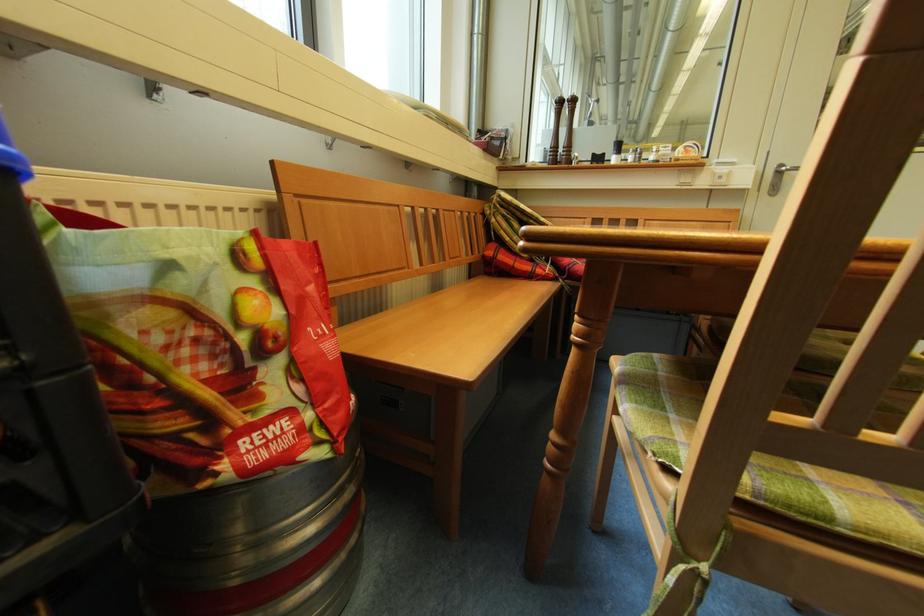
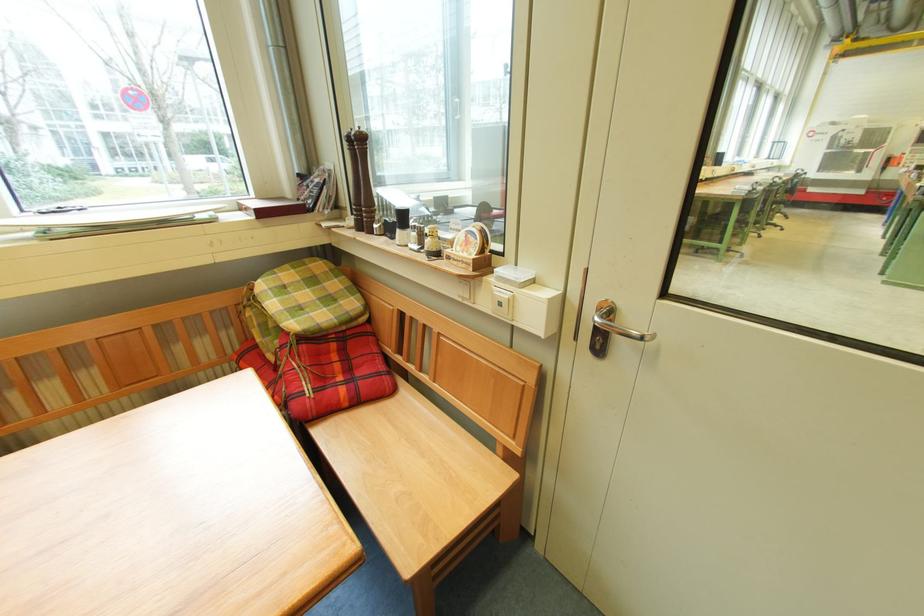
Question: I am providing you with two images of the same scene from different viewpoints. After the viewpoint changes to image2, which objects are now occluded?

Choices:
 (A) bench sitting surface
 (B) brown pepper grinder
 (C) small owl figurine
 (D) wooden bench sitting surface

Answer: (D)